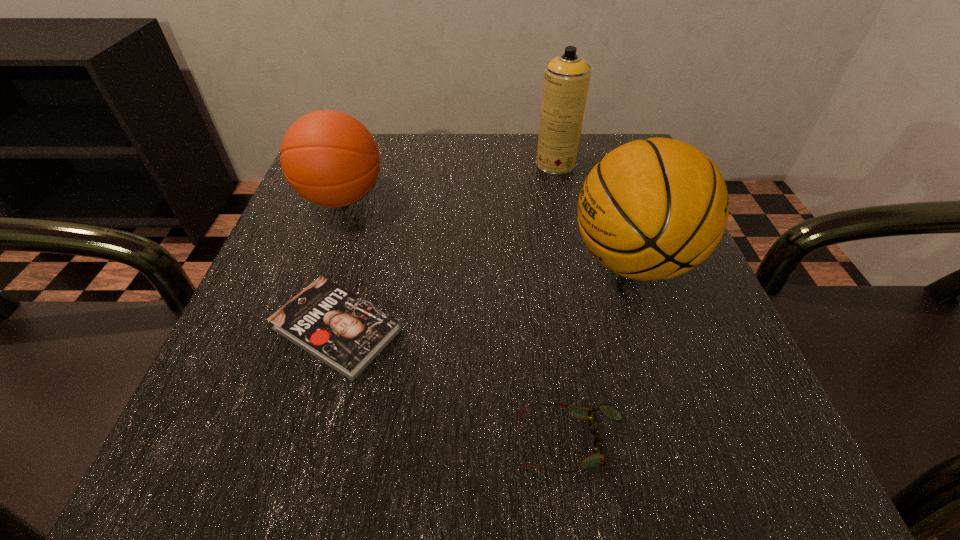
Find the location of a particular element. vacant space that's between the aerosol can and the nearest object is located at coordinates (564, 303).

The width and height of the screenshot is (960, 540). In order to click on object that stands as the second closest to the book in this screenshot , I will do `click(598, 459)`.

Select which object is the second closest to the left basketball. Please provide its 2D coordinates. Your answer should be formatted as a tuple, i.e. [(x, y)], where the tuple contains the x and y coordinates of a point satisfying the conditions above.

[(566, 80)]

Where is `vacant region that satisfies the following two spatial constraints: 1. on the back side of the aerosol can; 2. on the right side of the shortest object`? This screenshot has width=960, height=540. vacant region that satisfies the following two spatial constraints: 1. on the back side of the aerosol can; 2. on the right side of the shortest object is located at coordinates (384, 164).